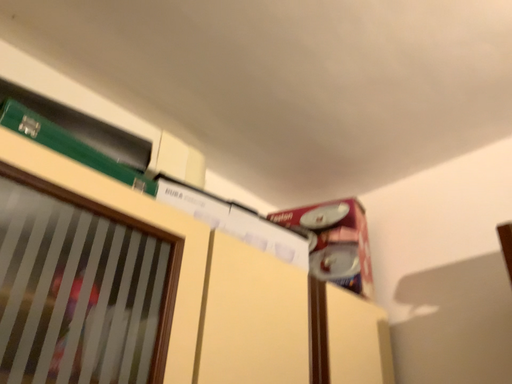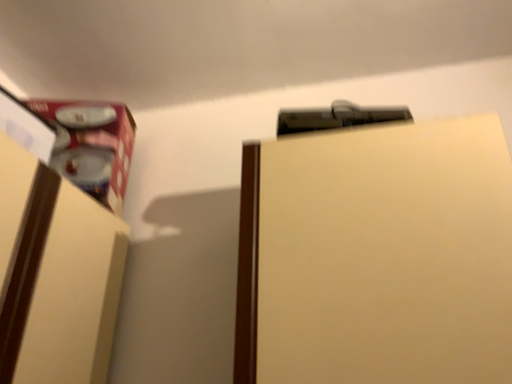
Question: Which way did the camera rotate in the video?

Choices:
 (A) rotated downward
 (B) rotated upward

Answer: (A)